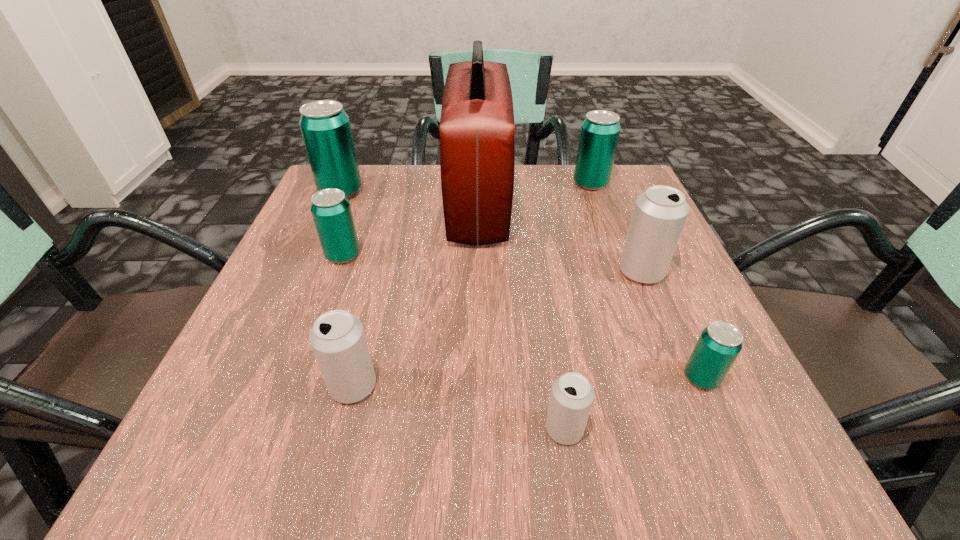
At what (x,y) coordinates should I click in order to perform the action: click on the fourth beer can from right to left. Please return your answer as a coordinate pair (x, y). Looking at the image, I should click on (572, 395).

Find the location of `the nearest object`. the nearest object is located at coordinates (572, 395).

Image resolution: width=960 pixels, height=540 pixels. What are the coordinates of `the smallest teal beer can` in the screenshot? It's located at (719, 344).

This screenshot has width=960, height=540. What are the coordinates of `vacant space located on the side of the first aid kit with the cross symbol` in the screenshot? It's located at (651, 203).

You are a GUI agent. You are given a task and a screenshot of the screen. Output one action in this format:
    pyautogui.click(x=<x>, y=<y>)
    Task: Click on the vacant space located on the right of the biggest teal beer can
    The height and width of the screenshot is (540, 960).
    Given the screenshot: What is the action you would take?
    click(x=419, y=192)

This screenshot has height=540, width=960. What are the coordinates of `free space located on the front of the second biggest teal beer can` in the screenshot? It's located at (623, 272).

Locate an element on the screen. vacant region located 0.100m on the back of the biggest white beer can is located at coordinates (623, 227).

The width and height of the screenshot is (960, 540). In order to click on vacant space situated on the right of the third object from left to right in this screenshot , I will do `click(439, 386)`.

You are a GUI agent. You are given a task and a screenshot of the screen. Output one action in this format:
    pyautogui.click(x=<x>, y=<y>)
    Task: Click on the vacant space located on the back of the third farthest teal beer can
    
    Given the screenshot: What is the action you would take?
    pyautogui.click(x=364, y=199)

You are a GUI agent. You are given a task and a screenshot of the screen. Output one action in this format:
    pyautogui.click(x=<x>, y=<y>)
    Task: Click on the free space located 0.170m on the right of the nearest white beer can
    Image resolution: width=960 pixels, height=540 pixels.
    Given the screenshot: What is the action you would take?
    pyautogui.click(x=711, y=429)